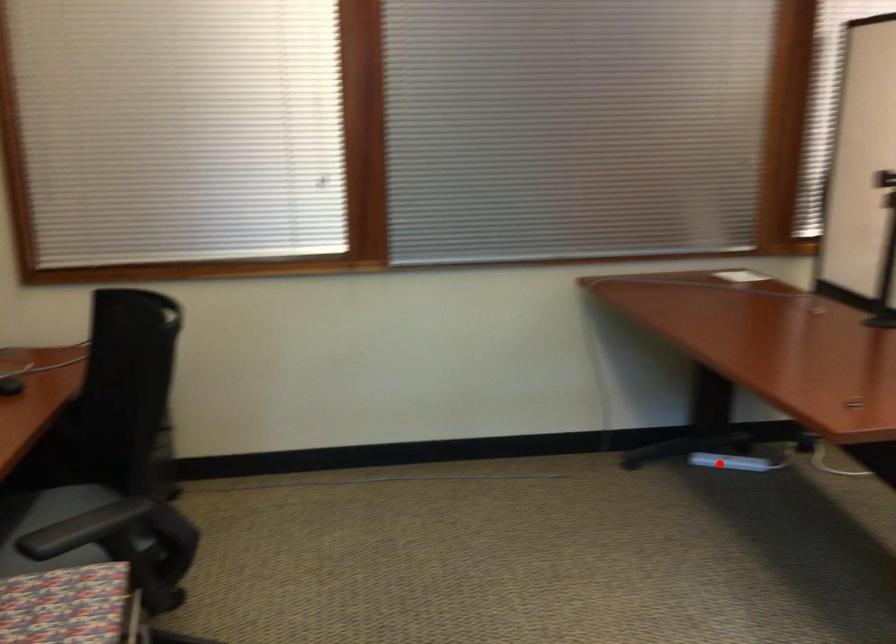
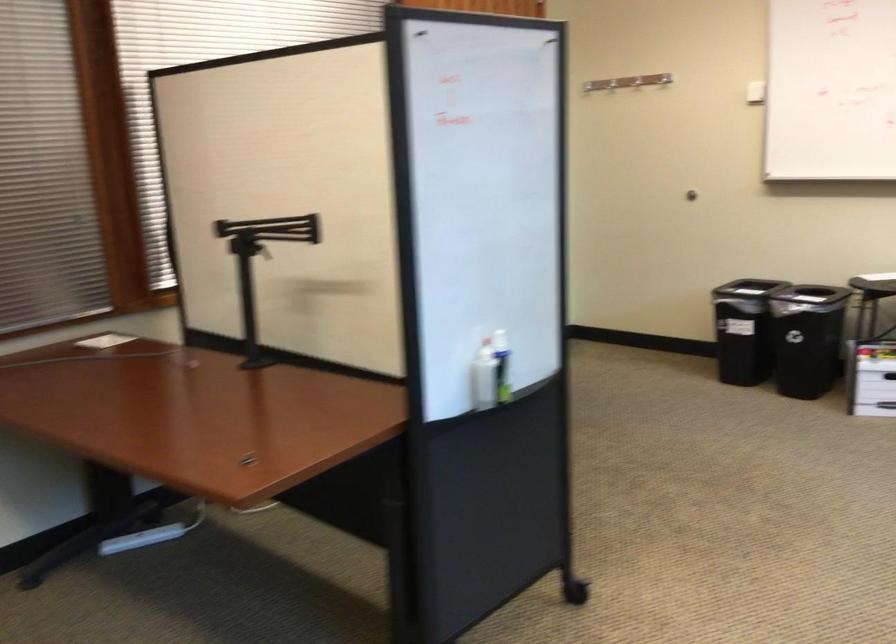
Where in the second image is the point corresponding to the highlighted location from the first image?

(141, 538)